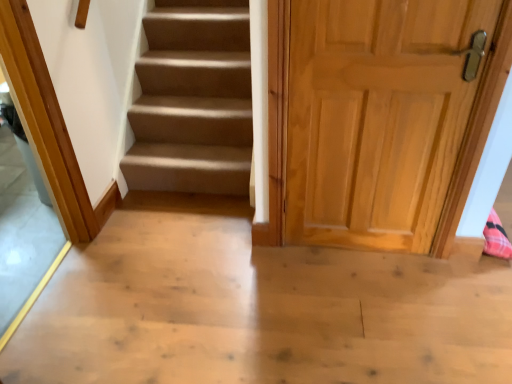
The height and width of the screenshot is (384, 512). I want to click on free point to the left of light brown wood door at right, so click(278, 271).